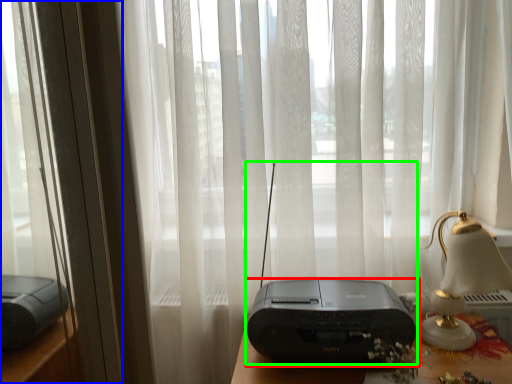
Question: Which object is the closest to the printer (highlighted by a red box)? Choose among these: window frame (highlighted by a blue box) or gadget (highlighted by a green box).

Choices:
 (A) window frame
 (B) gadget

Answer: (B)